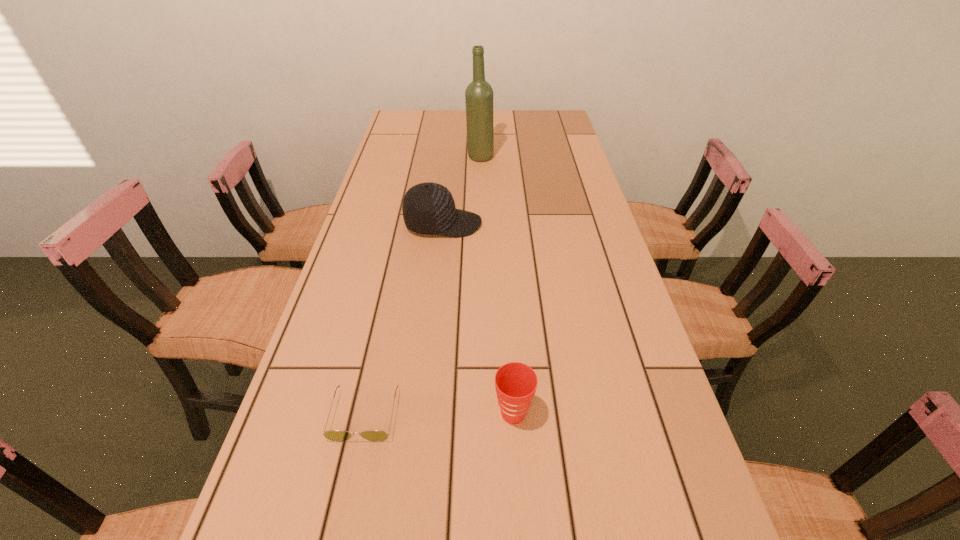
At what (x,y) coordinates should I click in order to perform the action: click on baseball cap located in the left edge section of the desktop. Please return your answer as a coordinate pair (x, y). Looking at the image, I should click on (428, 208).

Locate an element on the screen. This screenshot has height=540, width=960. sunglasses that is at the left edge is located at coordinates (333, 435).

Identify the location of free region at the far edge of the desktop. Image resolution: width=960 pixels, height=540 pixels. (519, 128).

This screenshot has width=960, height=540. In the image, there is a desktop. Identify the location of vacant space at the left edge. (387, 280).

Where is `free location at the right edge`? This screenshot has width=960, height=540. free location at the right edge is located at coordinates (578, 153).

The width and height of the screenshot is (960, 540). I want to click on vacant space at the far right corner, so click(538, 116).

Where is `free space between the cup and the second farthest object`? The image size is (960, 540). free space between the cup and the second farthest object is located at coordinates (478, 319).

This screenshot has width=960, height=540. Identify the location of free space between the farthest object and the shortest object. (422, 286).

The height and width of the screenshot is (540, 960). Find the location of `free space between the tallest object and the third nearest object`. free space between the tallest object and the third nearest object is located at coordinates (462, 191).

Where is `vacant area that lies between the wine bottle and the second farthest object`? The width and height of the screenshot is (960, 540). vacant area that lies between the wine bottle and the second farthest object is located at coordinates (462, 191).